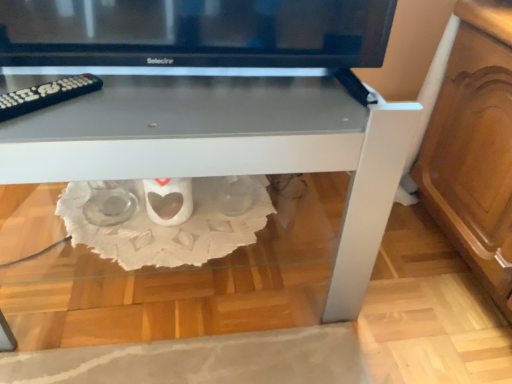
Question: Is black plastic remote at left wider or thinner than white glossy table at center?

Choices:
 (A) thin
 (B) wide

Answer: (A)

Question: From the image's perspective, is black plastic remote at left located above or below white glossy table at center?

Choices:
 (A) above
 (B) below

Answer: (A)

Question: Is black plastic remote at left bigger or smaller than white glossy table at center?

Choices:
 (A) small
 (B) big

Answer: (A)

Question: Does point (359, 246) appear closer or farther from the camera than point (58, 92)?

Choices:
 (A) farther
 (B) closer

Answer: (A)

Question: Is white glossy table at center inside the boundaries of black plastic remote at left, or outside?

Choices:
 (A) inside
 (B) outside

Answer: (B)

Question: In terms of height, does white glossy table at center look taller or shorter compared to black plastic remote at left?

Choices:
 (A) tall
 (B) short

Answer: (A)

Question: Based on their sizes in the image, would you say white glossy table at center is bigger or smaller than black plastic remote at left?

Choices:
 (A) small
 (B) big

Answer: (B)